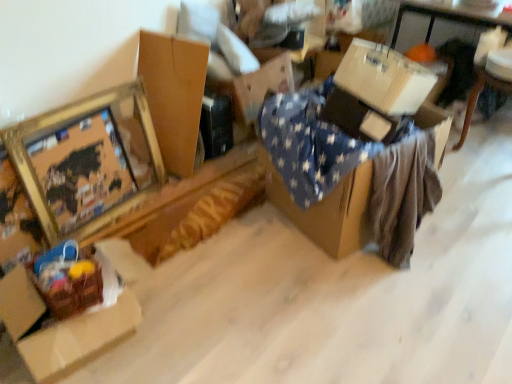
Question: Should I look upward or downward to see gold metallic picture frame at upper left?

Choices:
 (A) up
 (B) down

Answer: (A)

Question: Is white cardboard box at upper right, acting as the 2th table starting from the front, positioned with its back to gold metallic picture frame at upper left?

Choices:
 (A) no
 (B) yes

Answer: (A)

Question: Is white cardboard box at upper right, which is counted as the 1th table, starting from the back, positioned in front of gold metallic picture frame at upper left?

Choices:
 (A) yes
 (B) no

Answer: (B)

Question: Can you confirm if white cardboard box at upper right, acting as the 2th table starting from the front, is smaller than gold metallic picture frame at upper left?

Choices:
 (A) yes
 (B) no

Answer: (B)

Question: Is white cardboard box at upper right, acting as the 2th table starting from the front, next to gold metallic picture frame at upper left and touching it?

Choices:
 (A) yes
 (B) no

Answer: (B)

Question: Does white cardboard box at upper right, the 1th table when ordered from right to left, have a lesser height compared to gold metallic picture frame at upper left?

Choices:
 (A) no
 (B) yes

Answer: (A)

Question: From a real-world perspective, is white cardboard box at upper right, the 1th table when ordered from right to left, located beneath gold metallic picture frame at upper left?

Choices:
 (A) yes
 (B) no

Answer: (B)

Question: Is brown cardboard box at lower left, which is the first cardboard box from left to right, at the back of gold metallic picture frame at upper left?

Choices:
 (A) yes
 (B) no

Answer: (B)

Question: Is gold metallic picture frame at upper left facing towards brown cardboard box at lower left, which is the 3th cardboard box in right-to-left order?

Choices:
 (A) yes
 (B) no

Answer: (A)

Question: Does gold metallic picture frame at upper left have a greater height compared to brown cardboard box at lower left, which is the first cardboard box from left to right?

Choices:
 (A) no
 (B) yes

Answer: (B)

Question: From a real-world perspective, is gold metallic picture frame at upper left located beneath brown cardboard box at lower left, which is the first cardboard box from left to right?

Choices:
 (A) yes
 (B) no

Answer: (B)

Question: Considering the relative sizes of gold metallic picture frame at upper left and brown cardboard box at lower left, which is the first cardboard box from left to right, in the image provided, is gold metallic picture frame at upper left bigger than brown cardboard box at lower left, which is the first cardboard box from left to right,?

Choices:
 (A) yes
 (B) no

Answer: (B)

Question: Can you confirm if gold metallic picture frame at upper left is positioned to the left of brown cardboard box at lower left, which is the first cardboard box from left to right?

Choices:
 (A) yes
 (B) no

Answer: (A)

Question: From the image's perspective, is gold metallic picture frame at upper left on white corrugated cardboard box at upper right, the 1th cardboard box positioned from the right?

Choices:
 (A) no
 (B) yes

Answer: (A)